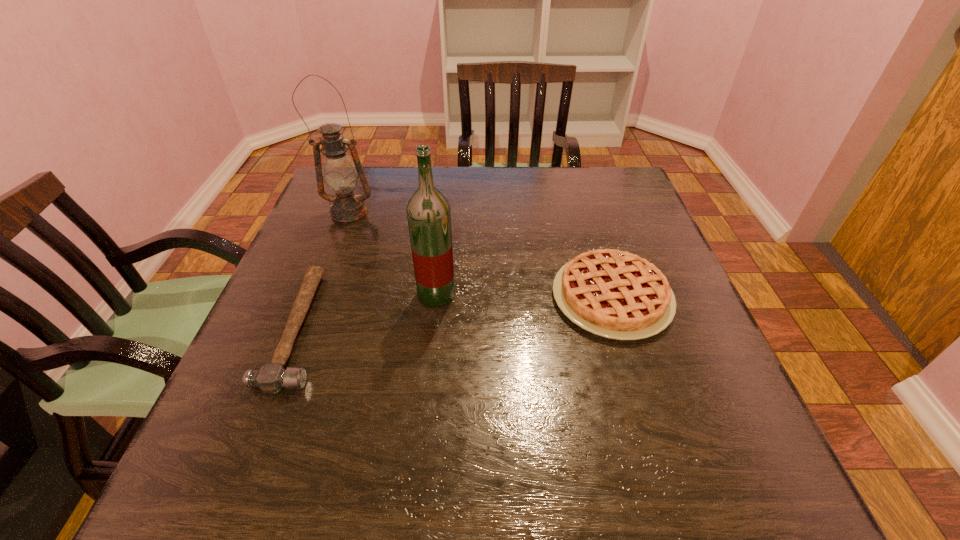
This screenshot has width=960, height=540. Identify the location of free space that is in between the farthest object and the second object from right to left. (393, 253).

This screenshot has height=540, width=960. Find the location of `blank region between the pie and the hammer`. blank region between the pie and the hammer is located at coordinates tap(455, 313).

At what (x,y) coordinates should I click in order to perform the action: click on free spot between the oil lamp and the second object from right to left. Please return your answer as a coordinate pair (x, y). Image resolution: width=960 pixels, height=540 pixels. Looking at the image, I should click on (393, 253).

This screenshot has width=960, height=540. Identify the location of vacant point located between the shortest object and the third object from left to right. (368, 311).

Identify the location of blank region between the pie and the third object from left to right. The image size is (960, 540). (524, 296).

I want to click on free point between the second object from right to left and the farthest object, so click(393, 253).

Image resolution: width=960 pixels, height=540 pixels. Identify the location of free area in between the farthest object and the hammer. (324, 270).

The height and width of the screenshot is (540, 960). In order to click on empty space between the hammer and the rightmost object in this screenshot , I will do `click(455, 313)`.

At what (x,y) coordinates should I click in order to perform the action: click on object that is the closest to the pie. Please return your answer as a coordinate pair (x, y). Image resolution: width=960 pixels, height=540 pixels. Looking at the image, I should click on (428, 211).

Identify which object is located as the second nearest to the shortest object. Please provide its 2D coordinates. Your answer should be formatted as a tuple, i.e. [(x, y)], where the tuple contains the x and y coordinates of a point satisfying the conditions above.

[(340, 175)]